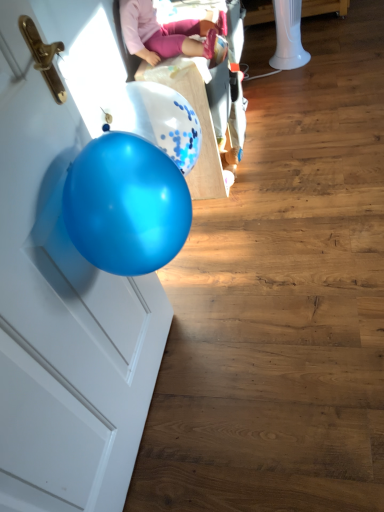
Question: Are pink fabric doll at upper center and glossy blue balloon at left making contact?

Choices:
 (A) yes
 (B) no

Answer: (B)

Question: Is pink fabric doll at upper center shorter than glossy blue balloon at left?

Choices:
 (A) no
 (B) yes

Answer: (B)

Question: From a real-world perspective, does pink fabric doll at upper center sit lower than glossy blue balloon at left?

Choices:
 (A) no
 (B) yes

Answer: (A)

Question: Is glossy blue balloon at left located within pink fabric doll at upper center?

Choices:
 (A) yes
 (B) no

Answer: (B)

Question: From a real-world perspective, is pink fabric doll at upper center located higher than glossy blue balloon at left?

Choices:
 (A) yes
 (B) no

Answer: (A)

Question: Is there a large distance between pink fabric doll at upper center and glossy blue balloon at left?

Choices:
 (A) yes
 (B) no

Answer: (B)

Question: Is white plastic baby carriage at upper center at the right side of pink fabric doll at upper center?

Choices:
 (A) yes
 (B) no

Answer: (A)

Question: Does white plastic baby carriage at upper center lie in front of pink fabric doll at upper center?

Choices:
 (A) yes
 (B) no

Answer: (B)

Question: Considering the relative sizes of white plastic baby carriage at upper center and pink fabric doll at upper center in the image provided, is white plastic baby carriage at upper center taller than pink fabric doll at upper center?

Choices:
 (A) no
 (B) yes

Answer: (B)

Question: From a real-world perspective, is white plastic baby carriage at upper center over pink fabric doll at upper center?

Choices:
 (A) yes
 (B) no

Answer: (B)

Question: Is white plastic baby carriage at upper center turned away from pink fabric doll at upper center?

Choices:
 (A) no
 (B) yes

Answer: (A)

Question: From the image's perspective, is white plastic baby carriage at upper center under pink fabric doll at upper center?

Choices:
 (A) no
 (B) yes

Answer: (B)

Question: Is white plastic baby carriage at upper center surrounded by glossy blue balloon at left?

Choices:
 (A) yes
 (B) no

Answer: (B)